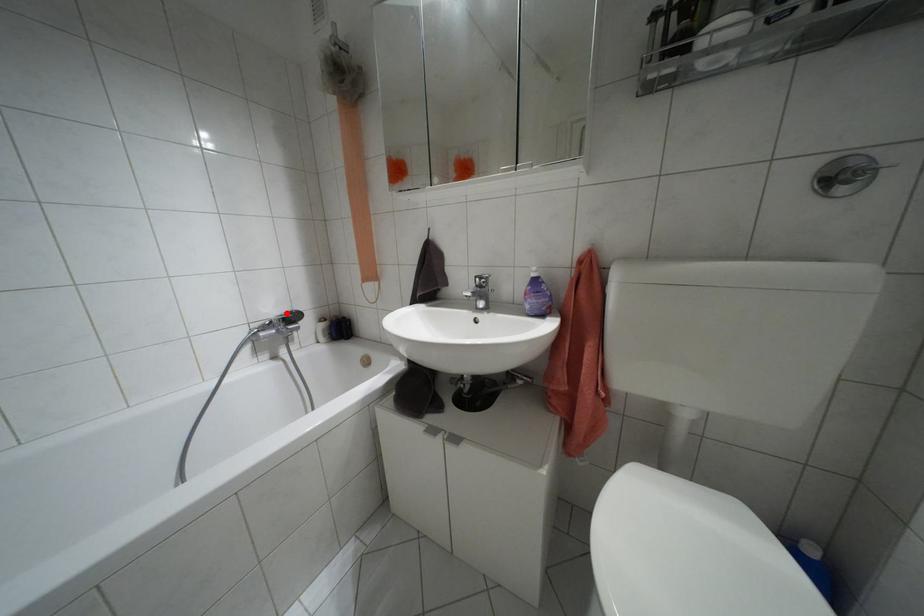
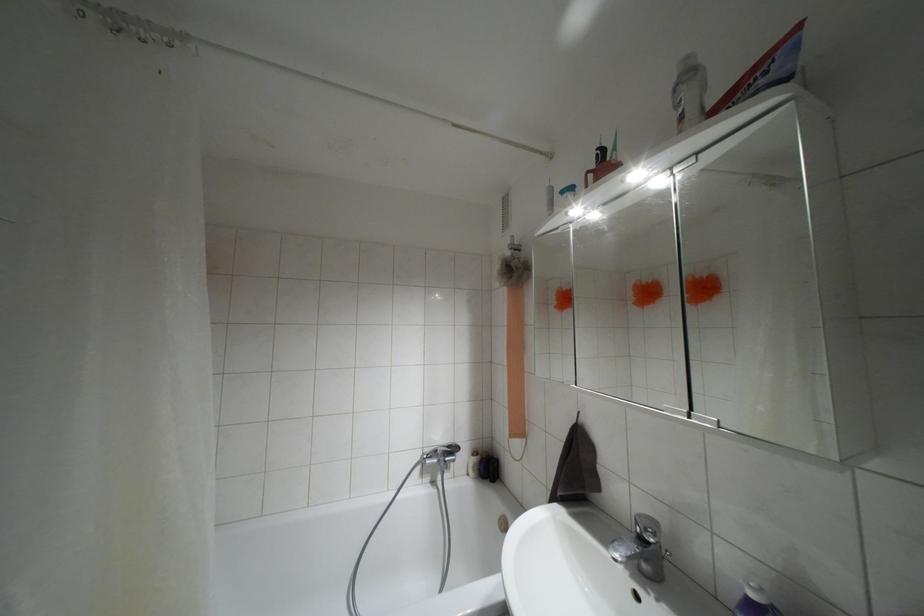
Question: I am providing you with two images of the same scene from different viewpoints. In image1, a red point is highlighted. Considering the same 3D point in image2, which of the following is correct?

Choices:
 (A) It is closer
 (B) It is farther

Answer: (B)